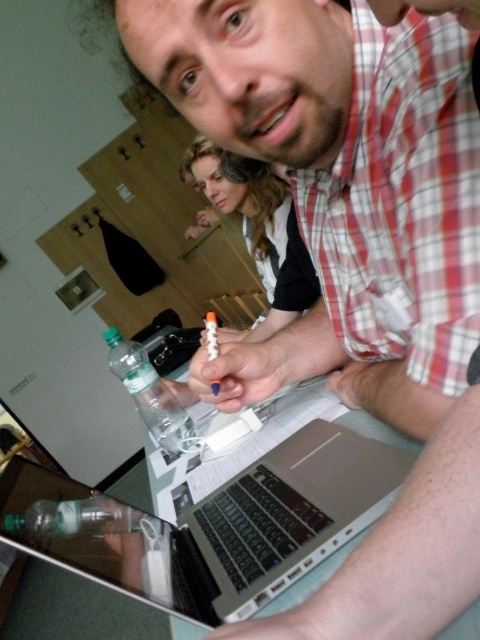
Consider the image. You are a photographer trying to capture a shot of the blonde hair at center and the clear plastic bottle at lower left. To ensure both are in focus, you need to know their vertical positions. Which one is higher?

The blonde hair at center is above the clear plastic bottle at lower left, so it is higher.

You are organizing a small meeting in this room and need to place a silver metallic laptop at center and a clear plastic bottle at lower left on a table. If the table has limited space, which object should you prioritize placing first to accommodate both items?

The silver metallic laptop at center should be prioritized because it is larger than the clear plastic bottle at lower left, so placing it first ensures there is enough space for both items.

You are a person who wants to place a new object at coordinate point 0.8, 0.45. Is there enough space to place it near the silver metallic laptop at center?

The silver metallic laptop at center is located at point (212, 524). Since the new object is at (216, 512), which is very close, there might not be enough space to place it near the silver metallic laptop at center without overlapping.